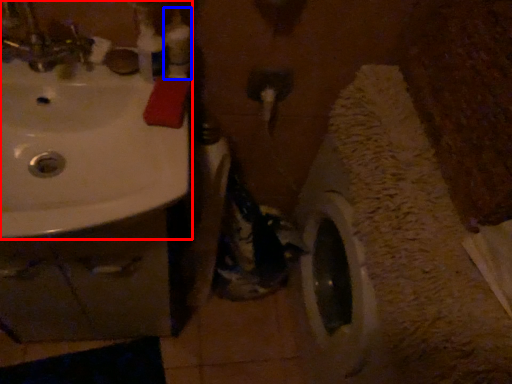
Question: Which of the following is the closest to the observer, sink (highlighted by a red box) or toiletry (highlighted by a blue box)?

Choices:
 (A) sink
 (B) toiletry

Answer: (A)